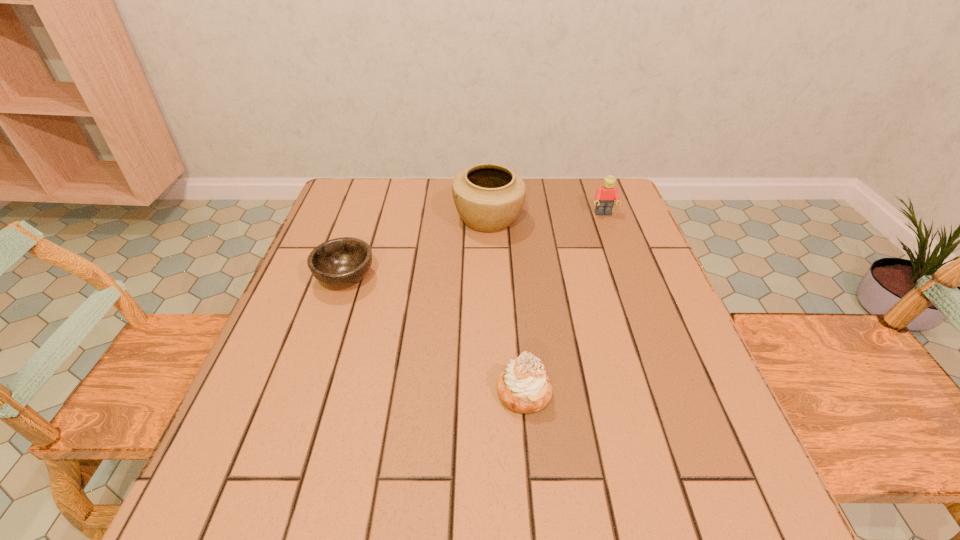
The width and height of the screenshot is (960, 540). In order to click on the tallest object in this screenshot , I will do `click(488, 197)`.

The height and width of the screenshot is (540, 960). Identify the location of the rightmost object. (605, 196).

Where is `the third shortest object`? Image resolution: width=960 pixels, height=540 pixels. the third shortest object is located at coordinates (605, 196).

This screenshot has height=540, width=960. I want to click on pastry, so [523, 387].

Where is `the third tallest object`? The width and height of the screenshot is (960, 540). the third tallest object is located at coordinates (523, 387).

At what (x,y) coordinates should I click in order to perform the action: click on the third farthest object. Please return your answer as a coordinate pair (x, y). This screenshot has width=960, height=540. Looking at the image, I should click on (340, 262).

The image size is (960, 540). In order to click on bowl in this screenshot , I will do `click(340, 262)`.

Image resolution: width=960 pixels, height=540 pixels. Identify the location of vacant region located on the left of the tallest object. (351, 219).

Where is `free region located on the face of the rightmost object`? free region located on the face of the rightmost object is located at coordinates (637, 307).

You are a GUI agent. You are given a task and a screenshot of the screen. Output one action in this format:
    pyautogui.click(x=<x>, y=<y>)
    Task: Click on the free space located on the front of the nearest object
    The image size is (960, 540).
    Given the screenshot: What is the action you would take?
    pyautogui.click(x=529, y=450)